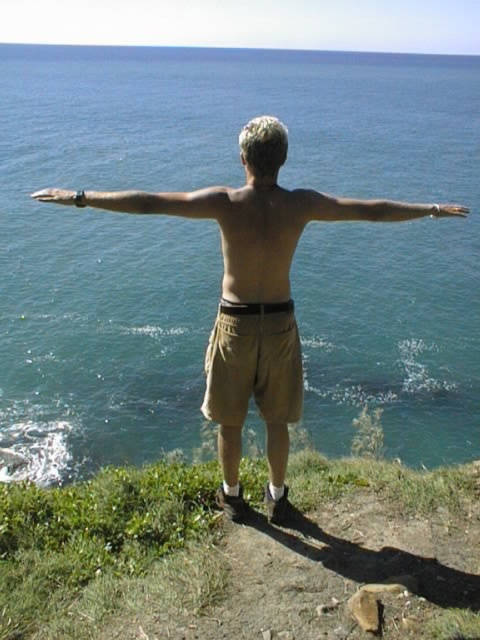
Question: Which point appears farthest from the camera in this image?

Choices:
 (A) (48, 188)
 (B) (177, 109)
 (C) (256, 380)
 (D) (298, 595)

Answer: (B)

Question: In this image, where is matte skin at upper center located relative to matte black hand at upper right?

Choices:
 (A) left
 (B) right

Answer: (A)

Question: Which of the following is the closest to the observer?

Choices:
 (A) blue water at center
 (B) khaki cotton shorts at center
 (C) matte skin at upper center

Answer: (C)

Question: Which object appears closest to the camera in this image?

Choices:
 (A) green grass at lower center
 (B) matte black hand at upper left
 (C) khaki cotton shorts at center

Answer: (A)

Question: Can you confirm if green grass at lower center is positioned below matte skin at upper center?

Choices:
 (A) no
 (B) yes

Answer: (B)

Question: Where is green grass at lower center located in relation to khaki cotton shorts at center in the image?

Choices:
 (A) above
 (B) below

Answer: (B)